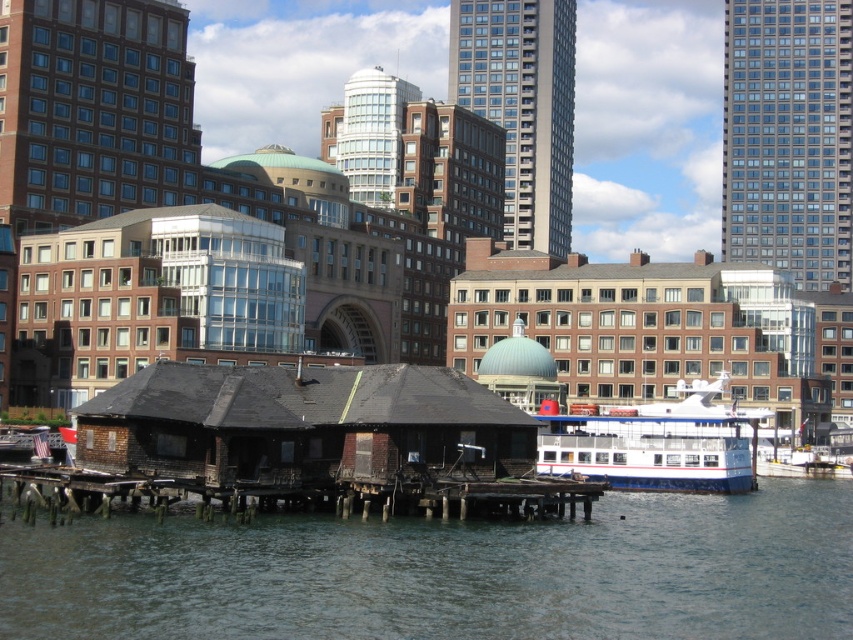
You are standing at the waterfront and want to take a photo of both the brown wooden hut at center and the smooth glass skyscraper at upper right. Which one should you focus on first to ensure both are in clear view?

You should focus on the brown wooden hut at center first since it is closer to you than the smooth glass skyscraper at upper right, ensuring both are in clear view by adjusting the focus accordingly.

You are a delivery person standing on the weathered wood dock at center and need to deliver a package to the weathered wood hut at center. The delivery robot you are using has a maximum operating range of 3 meters. Can the robot reach the hut from the dock?

The weathered wood hut at center is 2.94 meters away from the weathered wood dock at center. Since the robot has a maximum operating range of 3 meters, it can successfully reach the hut from the dock as the distance is within its capability.

In the scene shown: You are a delivery drone that needs to fly from the brown wooden hut at center to the smooth glass skyscraper at upper right. What is the minimum distance you must travel in feet?

The minimum distance you must travel is 305.07 feet between the brown wooden hut at center and the smooth glass skyscraper at upper right.